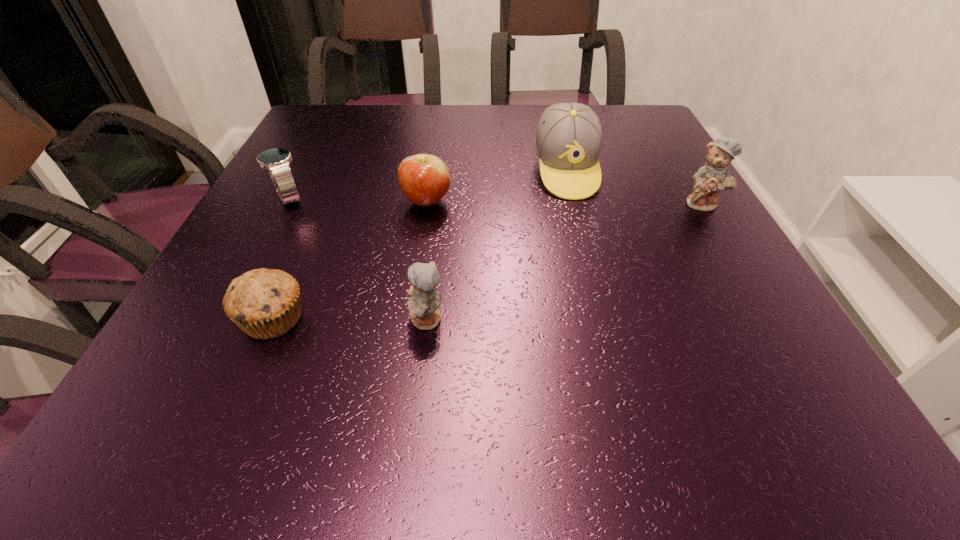
At what (x,y) coordinates should I click in order to perform the action: click on vacant space situated on the front-facing side of the left teddy bear. Please return your answer as a coordinate pair (x, y). This screenshot has width=960, height=540. Looking at the image, I should click on (276, 320).

Image resolution: width=960 pixels, height=540 pixels. Identify the location of vacant space located 0.120m on the front-facing side of the taller teddy bear. (732, 251).

Where is `free region located on the left of the apple`? free region located on the left of the apple is located at coordinates (350, 202).

The image size is (960, 540). In order to click on free point located on the back of the watch in this screenshot , I will do `click(324, 132)`.

The image size is (960, 540). Identify the location of vacant space located 0.210m on the front-facing side of the second object from right to left. (591, 267).

Identify the location of vacant region located 0.320m on the back of the muffin. This screenshot has width=960, height=540. (328, 189).

Where is `object that is positioned at the far edge`? The width and height of the screenshot is (960, 540). object that is positioned at the far edge is located at coordinates (x=568, y=140).

Image resolution: width=960 pixels, height=540 pixels. Find the location of `teddy bear that is at the near edge`. teddy bear that is at the near edge is located at coordinates (423, 305).

Identify the location of muffin that is at the near edge. (265, 303).

Locate an element on the screen. This screenshot has width=960, height=540. watch located in the left edge section of the desktop is located at coordinates (277, 161).